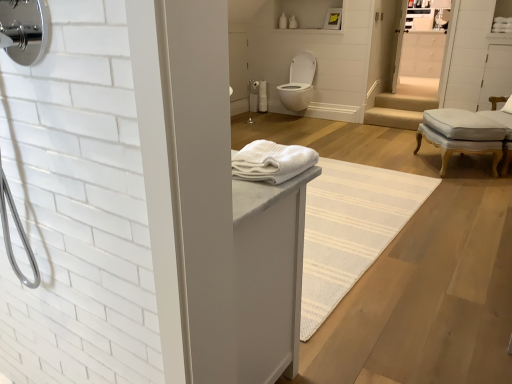
At what (x,y) coordinates should I click in order to perform the action: click on free point above white soft towel at center (from a real-world perspective). Please return your answer as a coordinate pair (x, y). The image size is (512, 384). Looking at the image, I should click on (274, 147).